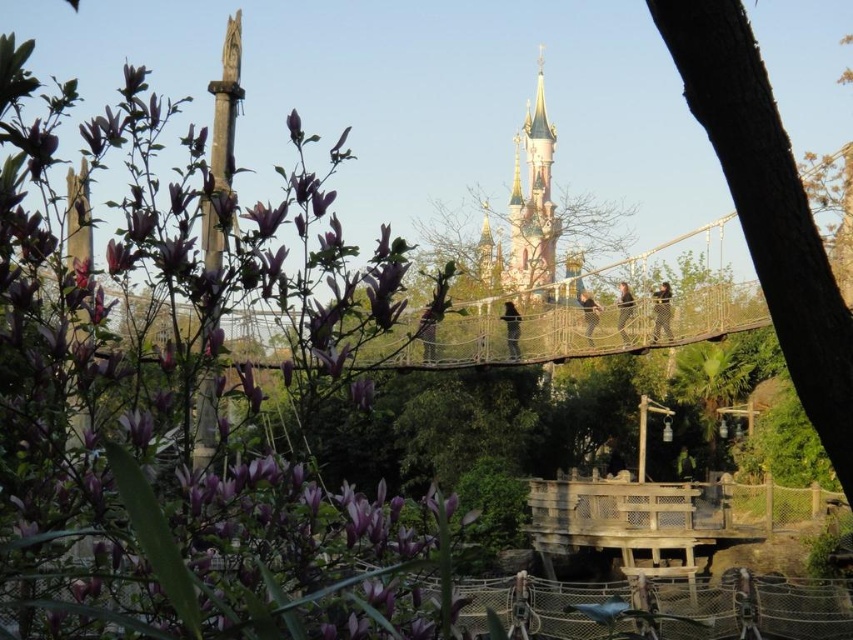
You are a visitor at Disneyland Paris and want to take a photo of the pastel pink castle at upper center without the brown rough bark tree at right blocking the view. Based on their sizes, which object should you move closer to or farther from to achieve this?

Since the brown rough bark tree at right is smaller than the pastel pink castle at upper center, moving closer to the tree would make it appear larger in the frame, potentially blocking the castle. To avoid this, you should move farther away from the tree so that it becomes smaller relative to the castle in your photo.

You are a visitor at Disneyland Paris and want to take a photo of the pastel pink castle at upper center without any obstructions. However, there is a brown rough bark tree at right in the way. Based on the scene description, can you determine if the tree is shorter than the castle? Please explain your reasoning.

The brown rough bark tree at right has a lesser height compared to the pastel pink castle at upper center. Since the tree is shorter than the castle, you can position yourself so that the tree doesn not block the view of the castle in your photo.